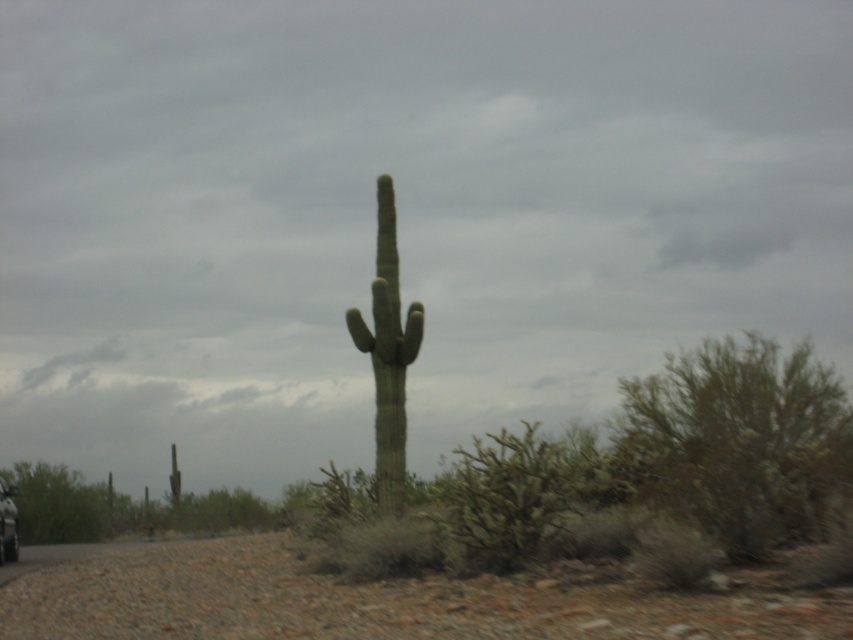
You are a hiker in the desert and see both the green spiny cactus at center and the green fuzzy cactus at center. Which one is taller?

The green fuzzy cactus at center is taller than the green spiny cactus at center.

You are driving a metallic silver car at lower left and want to park it near the green spiny cactus at center. Is the cactus to your right or left side as you face the cactus?

The green spiny cactus at center is to the right of the metallic silver car at lower left, so when facing the cactus, it would be on your right side.